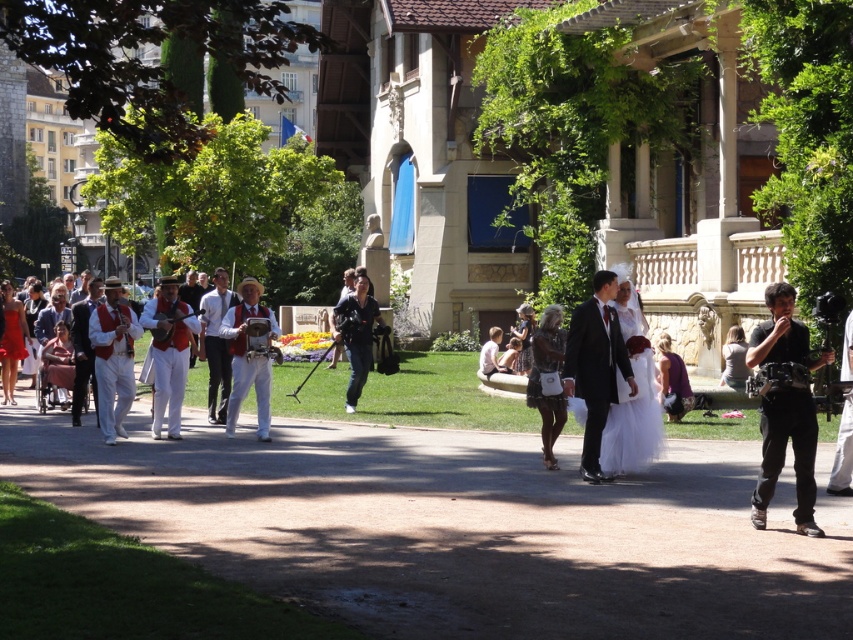
Is white cotton pants at center shorter than matte black camera at center?

Indeed, white cotton pants at center has a lesser height compared to matte black camera at center.

Is point (164, 360) less distant than point (358, 356)?

Yes, point (164, 360) is closer to viewer.

Between point (154, 410) and point (352, 401), which one is positioned behind?

The point (352, 401) is behind.

At what (x,y) coordinates should I click in order to perform the action: click on white cotton pants at center. Please return your answer as a coordinate pair (x, y). The image size is (853, 640). Looking at the image, I should click on [x=167, y=353].

Can you confirm if white cotton hat at center is wider than matte pink dress at left?

Yes.

Which is below, white cotton hat at center or matte pink dress at left?

matte pink dress at left is lower down.

Is point (236, 400) positioned after point (64, 376)?

No, (236, 400) is closer to viewer.

Identify the location of white cotton hat at center. (248, 355).

Measure the distance between point [775,301] and camera.

A distance of 37.08 feet exists between point [775,301] and camera.

Is point (793, 332) positioned behind point (6, 314)?

No.

Measure the distance between point (784, 426) and camera.

A distance of 11.10 meters exists between point (784, 426) and camera.

Locate an element on the screen. This screenshot has height=640, width=853. black matte camera at right is located at coordinates (785, 406).